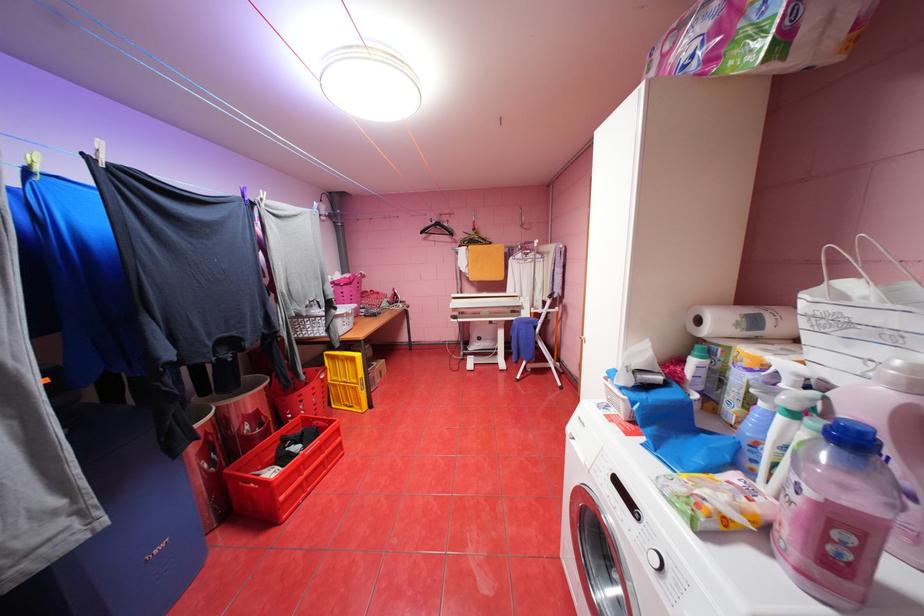
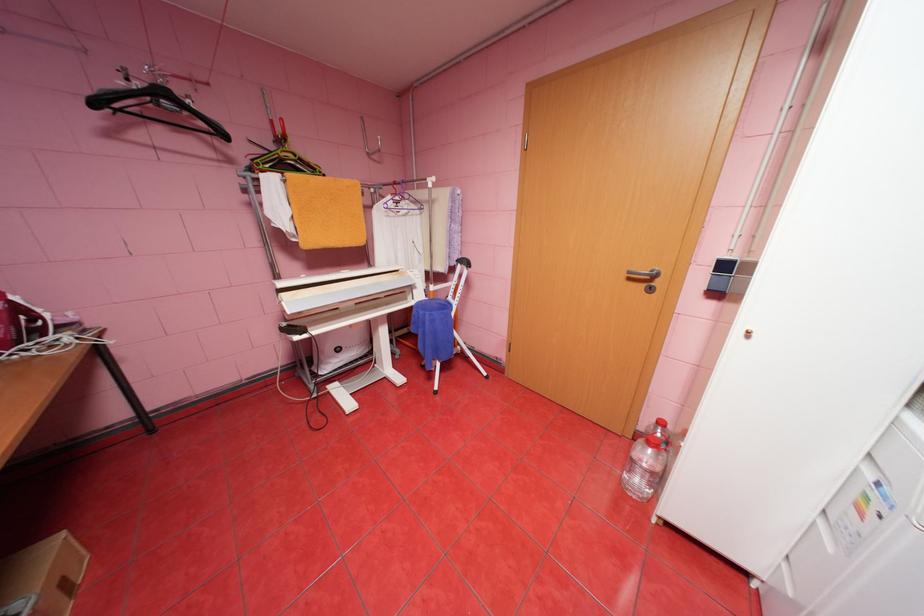
Locate, in the second image, the point that corresponds to pixel 404 294 in the first image.

(26, 309)